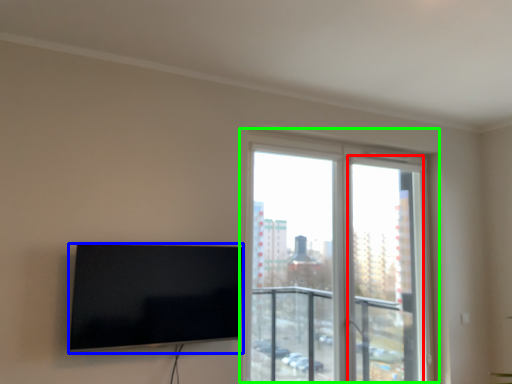
Question: Estimate the real-world distances between objects in this image. Which object is closer to screen door (highlighted by a red box), television (highlighted by a blue box) or window (highlighted by a green box)?

Choices:
 (A) television
 (B) window

Answer: (B)